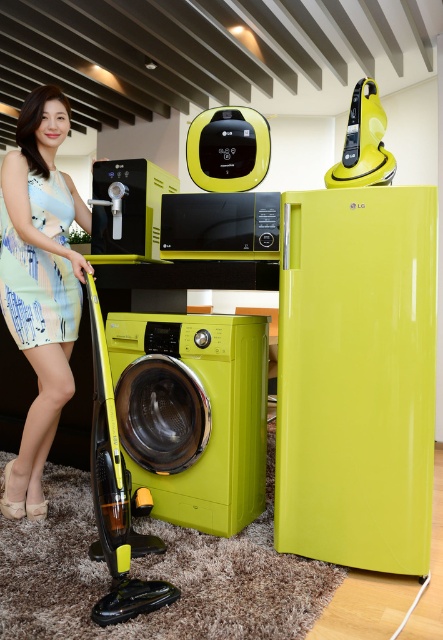
Which of these two, matte blue dress at center or printed fabric dress at left, stands shorter?

printed fabric dress at left is shorter.

Is matte blue dress at center to the left of printed fabric dress at left from the viewer's perspective?

Indeed, matte blue dress at center is positioned on the left side of printed fabric dress at left.

At what (x,y) coordinates should I click in order to perform the action: click on matte blue dress at center. Please return your answer as a coordinate pair (x, y). Looking at the image, I should click on (39, 284).

The image size is (443, 640). Identify the location of matte blue dress at center. (39, 284).

Does matte blue dress at center have a lesser height compared to matte black water dispenser at center?

Incorrect, matte blue dress at center's height does not fall short of matte black water dispenser at center's.

Does matte blue dress at center come behind matte black water dispenser at center?

That is False.

Between point (38, 92) and point (101, 220), which one is positioned behind?

The point (101, 220) is behind.

The width and height of the screenshot is (443, 640). I want to click on matte blue dress at center, so click(39, 284).

Does matte yellow washing machine at center appear on the left side of matte black water dispenser at center?

No, matte yellow washing machine at center is not to the left of matte black water dispenser at center.

Who is more forward, (178, 444) or (121, 253)?

Point (178, 444) is more forward.

You are a GUI agent. You are given a task and a screenshot of the screen. Output one action in this format:
    pyautogui.click(x=<x>, y=<y>)
    Task: Click on the matte yellow washing machine at center
    
    Given the screenshot: What is the action you would take?
    pyautogui.click(x=193, y=413)

This screenshot has height=640, width=443. What are the coordinates of `matte yellow washing machine at center` in the screenshot? It's located at (193, 413).